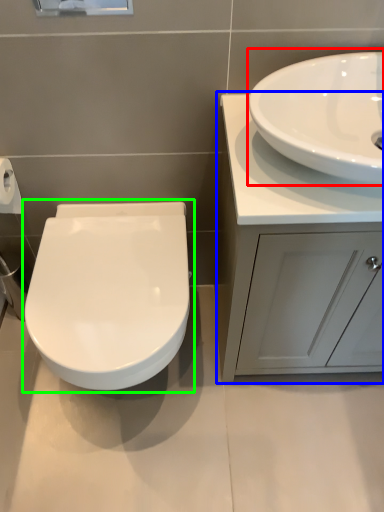
Question: Which object is positioned closest to sink (highlighted by a red box)? Select from bathroom cabinet (highlighted by a blue box) and toilet (highlighted by a green box).

Choices:
 (A) bathroom cabinet
 (B) toilet

Answer: (A)